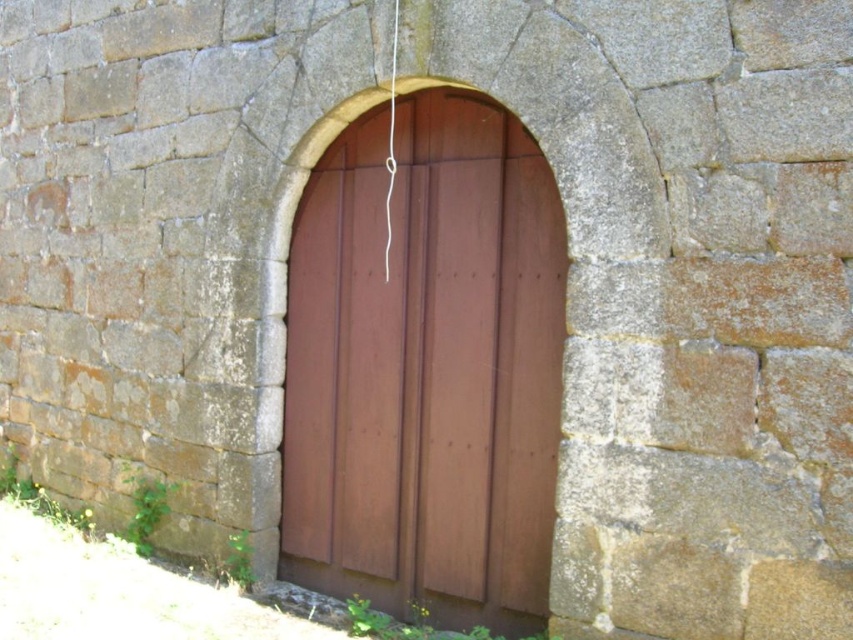
You are standing in front of the stone wall with an arched doorway. You see a brown wooden door at center and a white string at center. Which object is closer to you?

The brown wooden door at center is closer to you because it is in front of the white string at center.

You are a painter who needs to hang a 24 inch wide painting on the wall. You see the brown wooden door at center and the white string at center. Can you hang the painting between them?

The brown wooden door at center is 24.80 inches from the white string at center. Since the painting is 24 inches wide, it can fit between them with a small gap of 0.8 inches remaining.